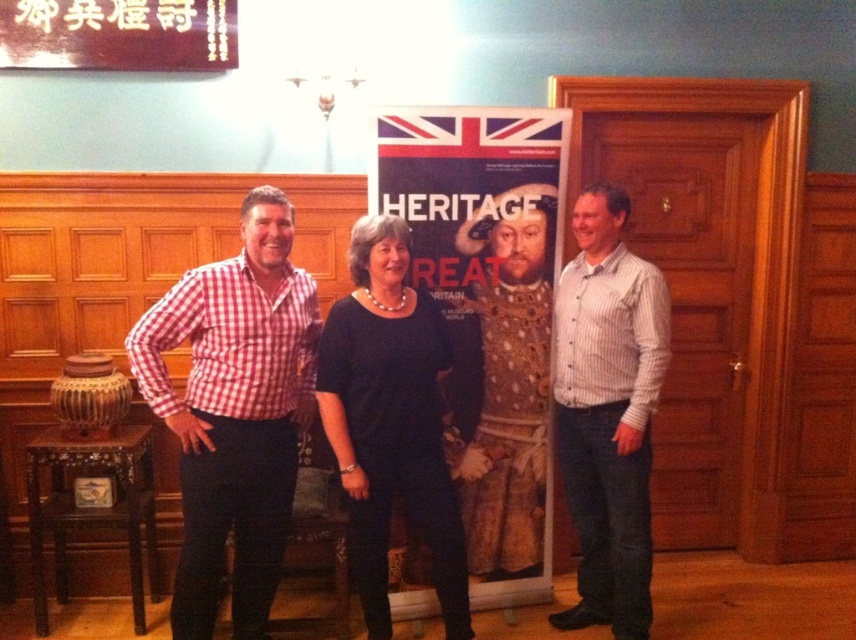
Based on the photo, you are standing in the room and want to hand a document to the person wearing the red checkered shirt at left. Where should you approach to find them?

The person wearing the red checkered shirt at left is located at position point (x=235, y=412), so you should approach that coordinate to find them.

You are a photographer setting up a shoot in this room. You need to position a small tripod between the white striped shirt at right and the dark wood stool at lower left. Based on their positions, which object should the tripod be closer to?

The white striped shirt at right is positioned on the right side of the dark wood stool at lower left, so the tripod should be placed closer to the dark wood stool at lower left to maintain symmetry between the two objects.